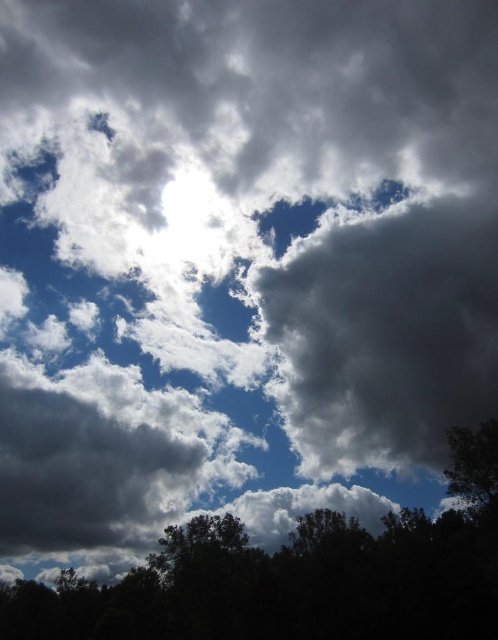
Between dark gray fluffy cloud at upper center and dark green leafy tree at bottom, which one is positioned higher?

dark gray fluffy cloud at upper center

This screenshot has height=640, width=498. What are the coordinates of `dark gray fluffy cloud at upper center` in the screenshot? It's located at (383, 330).

The image size is (498, 640). What do you see at coordinates (383, 330) in the screenshot?
I see `dark gray fluffy cloud at upper center` at bounding box center [383, 330].

The image size is (498, 640). Find the location of `dark gray fluffy cloud at upper center`. dark gray fluffy cloud at upper center is located at coordinates (383, 330).